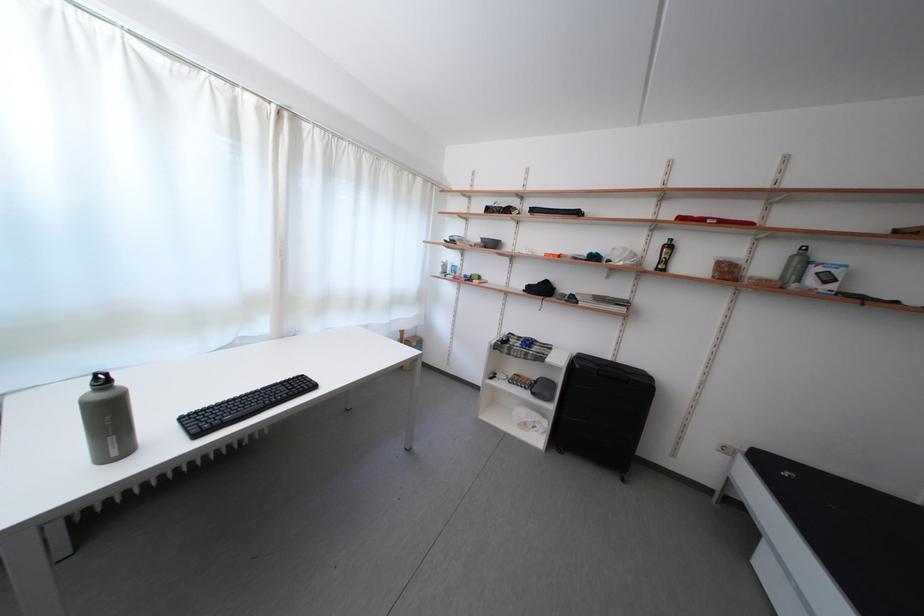
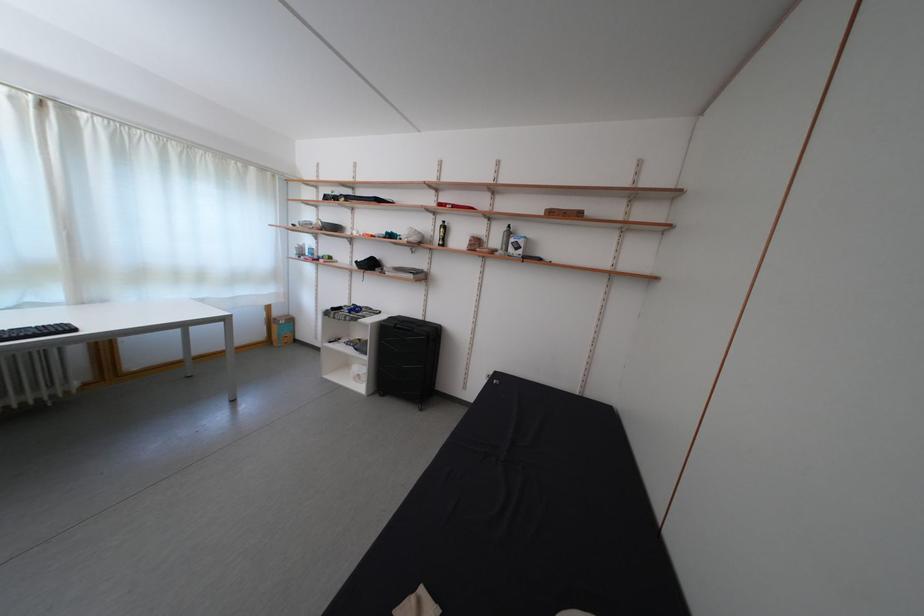
What movement of the cameraman would produce the second image?

The cameraman moved toward right, backward.